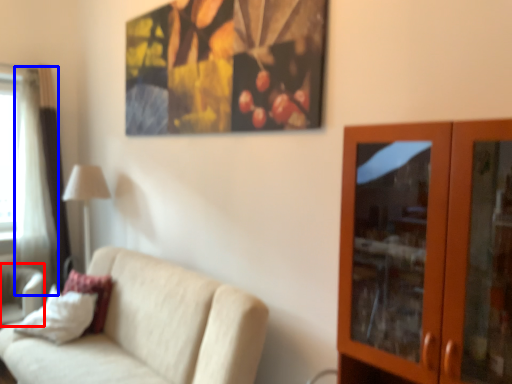
Question: Among these objects, which one is farthest to the camera, swivel chair (highlighted by a red box) or curtain (highlighted by a blue box)?

Choices:
 (A) swivel chair
 (B) curtain

Answer: (B)